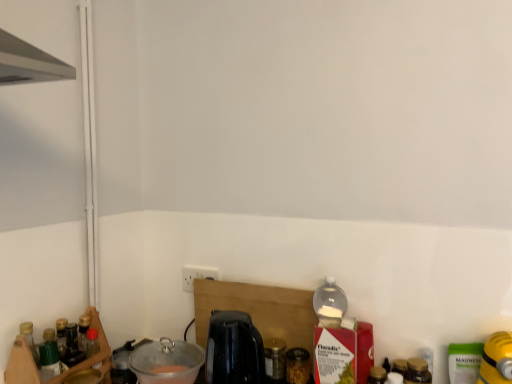
What do you see at coordinates (417, 372) in the screenshot? The image size is (512, 384). I see `brown glass jar at lower right, the first bottle when ordered from right to left` at bounding box center [417, 372].

How much space does brown glass jar at lower right, the first bottle in the front-to-back sequence, occupy horizontally?

brown glass jar at lower right, the first bottle in the front-to-back sequence, is 4.28 inches in width.

Describe the element at coordinates (497, 359) in the screenshot. The image size is (512, 384). I see `yellow rubber glove at lower right, which is the 1th appliance in right-to-left order` at that location.

The width and height of the screenshot is (512, 384). Describe the element at coordinates (234, 350) in the screenshot. I see `black glossy coffee machine at center` at that location.

Where is `metallic black kettle at lower left, which appears as the first appliance when viewed from the left`? Image resolution: width=512 pixels, height=384 pixels. metallic black kettle at lower left, which appears as the first appliance when viewed from the left is located at coordinates (124, 363).

The image size is (512, 384). What do you see at coordinates (298, 366) in the screenshot?
I see `translucent glass jar at center, the second bottle viewed from the left` at bounding box center [298, 366].

The image size is (512, 384). In order to click on transparent glass jar at center, acting as the first bottle starting from the left in this screenshot , I will do `click(275, 360)`.

Between yellow rubber glove at lower right, which is counted as the 3th appliance, starting from the left, and brown glass jar at lower right, the first bottle in the front-to-back sequence, which one has larger size?

yellow rubber glove at lower right, which is counted as the 3th appliance, starting from the left, is bigger.

Considering the points (505, 373) and (413, 369), which point is behind, point (505, 373) or point (413, 369)?

The point (413, 369) is farther.

Which object is closer to the camera taking this photo, yellow rubber glove at lower right, which is the 1th appliance in right-to-left order, or brown glass jar at lower right, acting as the third bottle starting from the back?

yellow rubber glove at lower right, which is the 1th appliance in right-to-left order, is in front.

Does yellow rubber glove at lower right, which is the 1th appliance in right-to-left order, appear on the right side of brown glass jar at lower right, the 3th bottle in the left-to-right sequence?

Correct, you'll find yellow rubber glove at lower right, which is the 1th appliance in right-to-left order, to the right of brown glass jar at lower right, the 3th bottle in the left-to-right sequence.

In the scene shown: Is translucent glass jar at center, which is the 2th bottle from front to back, bigger or smaller than wooden spice rack at left?

Clearly, translucent glass jar at center, which is the 2th bottle from front to back, is smaller in size than wooden spice rack at left.

From the image's perspective, which object appears higher, translucent glass jar at center, arranged as the 2th bottle when viewed from the back, or wooden spice rack at left?

wooden spice rack at left is shown above in the image.

Which is less distant, [295,376] or [20,372]?

Positioned in front is point [20,372].

Is brown glass jar at lower right, acting as the third bottle starting from the back, not within black glossy coffee machine at center?

brown glass jar at lower right, acting as the third bottle starting from the back, lies outside black glossy coffee machine at center's area.

Is brown glass jar at lower right, the first bottle when ordered from right to left, not close to black glossy coffee machine at center?

No, brown glass jar at lower right, the first bottle when ordered from right to left, is in close proximity to black glossy coffee machine at center.

The height and width of the screenshot is (384, 512). Find the location of `the 3rd bottle to the right of the black glossy coffee machine at center, starting your count from the anchor`. the 3rd bottle to the right of the black glossy coffee machine at center, starting your count from the anchor is located at coordinates (417, 372).

From the image's perspective, which is above, brown glass jar at lower right, the first bottle in the front-to-back sequence, or black glossy coffee machine at center?

black glossy coffee machine at center appears higher in the image.

Could metallic black kettle at lower left, arranged as the 3th appliance when viewed from the right, be considered to be inside black glossy coffee machine at center?

No, metallic black kettle at lower left, arranged as the 3th appliance when viewed from the right, is not a part of black glossy coffee machine at center.

Is black glossy coffee machine at center turned away from metallic black kettle at lower left, arranged as the 3th appliance when viewed from the right?

No, black glossy coffee machine at center is not facing away from metallic black kettle at lower left, arranged as the 3th appliance when viewed from the right.

Is the depth of black glossy coffee machine at center less than that of metallic black kettle at lower left, which appears as the first appliance when viewed from the left?

Yes, black glossy coffee machine at center is closer to the viewer.

Is point (227, 373) behind point (117, 357)?

No, it is in front of (117, 357).

Between yellow rubber glove at lower right, which is the 1th appliance in right-to-left order, and metallic black kettle at lower left, arranged as the 3th appliance when viewed from the right, which one is positioned behind?

metallic black kettle at lower left, arranged as the 3th appliance when viewed from the right.

How many degrees apart are the facing directions of yellow rubber glove at lower right, which is counted as the 3th appliance, starting from the left, and metallic black kettle at lower left, arranged as the 3th appliance when viewed from the right?

The angle between the facing direction of yellow rubber glove at lower right, which is counted as the 3th appliance, starting from the left, and the facing direction of metallic black kettle at lower left, arranged as the 3th appliance when viewed from the right, is 0.00583 degrees.

Is yellow rubber glove at lower right, which is counted as the 3th appliance, starting from the left, facing away from metallic black kettle at lower left, which appears as the first appliance when viewed from the left?

No, yellow rubber glove at lower right, which is counted as the 3th appliance, starting from the left,'s orientation is not away from metallic black kettle at lower left, which appears as the first appliance when viewed from the left.

Considering the sizes of objects yellow rubber glove at lower right, which is the 1th appliance in right-to-left order, and metallic black kettle at lower left, which appears as the first appliance when viewed from the left, in the image provided, who is bigger, yellow rubber glove at lower right, which is the 1th appliance in right-to-left order, or metallic black kettle at lower left, which appears as the first appliance when viewed from the left,?

yellow rubber glove at lower right, which is the 1th appliance in right-to-left order, is bigger.

Considering the relative positions of black glossy coffee machine at center and brown glass jar at lower right, the first bottle in the front-to-back sequence, in the image provided, is black glossy coffee machine at center to the left of brown glass jar at lower right, the first bottle in the front-to-back sequence, from the viewer's perspective?

Indeed, black glossy coffee machine at center is positioned on the left side of brown glass jar at lower right, the first bottle in the front-to-back sequence.

Based on the photo, which of these two, black glossy coffee machine at center or brown glass jar at lower right, acting as the third bottle starting from the back, stands shorter?

brown glass jar at lower right, acting as the third bottle starting from the back, is shorter.

Is point (240, 335) positioned behind point (415, 378)?

Yes, point (240, 335) is farther from viewer.

Where is `the 1st bottle behind the black glossy coffee machine at center`? The height and width of the screenshot is (384, 512). the 1st bottle behind the black glossy coffee machine at center is located at coordinates (417, 372).

From a real-world perspective, which object rests below the other?

translucent glass jar at center, which is the 2th bottle from front to back, is physically lower.

Considering the positions of objects translucent glass jar at center, which is the 2th bottle from front to back, and black glossy coffee machine at center in the image provided, who is more to the left, translucent glass jar at center, which is the 2th bottle from front to back, or black glossy coffee machine at center?

black glossy coffee machine at center is more to the left.

From the picture: Is translucent glass jar at center, arranged as the 2th bottle when viewed from the back, located outside black glossy coffee machine at center?

Yes, translucent glass jar at center, arranged as the 2th bottle when viewed from the back, is outside of black glossy coffee machine at center.

From the picture: Who is taller, translucent glass jar at center, arranged as the 2th bottle when viewed from the back, or black glossy coffee machine at center?

Standing taller between the two is black glossy coffee machine at center.

Where is `bottle that is the 1st one when counting downward from the yellow rubber glove at lower right, which is the 1th appliance in right-to-left order (from the image's perspective)`? bottle that is the 1st one when counting downward from the yellow rubber glove at lower right, which is the 1th appliance in right-to-left order (from the image's perspective) is located at coordinates (417, 372).

From a real-world perspective, starting from the wooden spice rack at left, which bottle is the 3rd one below it? Please provide its 2D coordinates.

[(298, 366)]

Which object lies nearer to the anchor point transparent glass jar at center, arranged as the 3th bottle when viewed from the front, yellow rubber glove at lower right, which is the 1th appliance in right-to-left order, or translucent glass jar at center, the second bottle viewed from the left?

Among the two, translucent glass jar at center, the second bottle viewed from the left, is located nearer to transparent glass jar at center, arranged as the 3th bottle when viewed from the front.

From the image, which object appears to be farther from brown glass jar at lower right, acting as the third bottle starting from the back, clear plastic bowl at lower left, the second appliance positioned from the right, or yellow rubber glove at lower right, which is the 1th appliance in right-to-left order?

Among the two, clear plastic bowl at lower left, the second appliance positioned from the right, is located further to brown glass jar at lower right, acting as the third bottle starting from the back.

From the image, which object appears to be nearer to translucent glass jar at center, the second bottle viewed from the left, black glossy coffee machine at center or transparent glass jar at center, arranged as the 3th bottle when viewed from the front?

The object closer to translucent glass jar at center, the second bottle viewed from the left, is transparent glass jar at center, arranged as the 3th bottle when viewed from the front.

Which object lies nearer to the anchor point yellow rubber glove at lower right, which is the 1th appliance in right-to-left order, black glossy coffee machine at center or clear plastic bowl at lower left, the second appliance positioned from the right?

black glossy coffee machine at center lies closer to yellow rubber glove at lower right, which is the 1th appliance in right-to-left order, than the other object.

When comparing their distances from black glossy coffee machine at center, does metallic black kettle at lower left, arranged as the 3th appliance when viewed from the right, or translucent glass jar at center, which ranks as the 2th bottle in right-to-left order, seem closer?

Among the two, translucent glass jar at center, which ranks as the 2th bottle in right-to-left order, is located nearer to black glossy coffee machine at center.

Estimate the real-world distances between objects in this image. Which object is further from transparent glass jar at center, the 3th bottle viewed from the right, metallic black kettle at lower left, which appears as the first appliance when viewed from the left, or wooden spice rack at left?

Among the two, wooden spice rack at left is located further to transparent glass jar at center, the 3th bottle viewed from the right.

Considering their positions, is brown glass jar at lower right, the 3th bottle in the left-to-right sequence, positioned further to metallic black kettle at lower left, which appears as the first appliance when viewed from the left, than black glossy coffee machine at center?

brown glass jar at lower right, the 3th bottle in the left-to-right sequence.

Looking at the image, which one is located further to translucent glass jar at center, which is the 2th bottle from front to back, black glossy coffee machine at center or brown glass jar at lower right, the first bottle in the front-to-back sequence?

Among the two, brown glass jar at lower right, the first bottle in the front-to-back sequence, is located further to translucent glass jar at center, which is the 2th bottle from front to back.

Find the location of a particular element. This screenshot has width=512, height=384. appliance between metallic black kettle at lower left, arranged as the 3th appliance when viewed from the right, and brown glass jar at lower right, acting as the third bottle starting from the back, from left to right is located at coordinates (167, 362).

Locate an element on the screen. The height and width of the screenshot is (384, 512). coffee machine between clear plastic bowl at lower left, the second appliance positioned from the right, and translucent glass jar at center, which is the 2th bottle from front to back, from left to right is located at coordinates (234, 350).

Locate an element on the screen. coffee machine between metallic black kettle at lower left, arranged as the 3th appliance when viewed from the right, and translucent glass jar at center, the second bottle viewed from the left is located at coordinates (234, 350).

The image size is (512, 384). I want to click on coffee machine between clear plastic bowl at lower left, the second appliance positioned from the right, and brown glass jar at lower right, the 3th bottle in the left-to-right sequence, in the horizontal direction, so pyautogui.click(x=234, y=350).